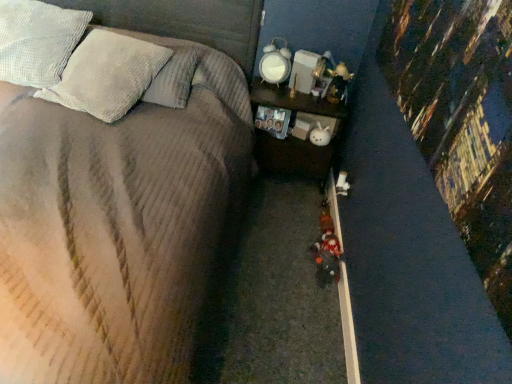
Question: From the image's perspective, is corduroy fabric bed at center under wooden nightstand at center?

Choices:
 (A) yes
 (B) no

Answer: (A)

Question: Is corduroy fabric bed at center further to camera compared to wooden nightstand at center?

Choices:
 (A) no
 (B) yes

Answer: (A)

Question: From a real-world perspective, is corduroy fabric bed at center over wooden nightstand at center?

Choices:
 (A) no
 (B) yes

Answer: (B)

Question: Is corduroy fabric bed at center smaller than wooden nightstand at center?

Choices:
 (A) no
 (B) yes

Answer: (A)

Question: Is corduroy fabric bed at center to the left of wooden nightstand at center from the viewer's perspective?

Choices:
 (A) yes
 (B) no

Answer: (A)

Question: Looking at their shapes, would you say smooth concrete curb at lower right is wider or thinner than plush fabric toy at center?

Choices:
 (A) wide
 (B) thin

Answer: (B)

Question: Is point (330, 196) positioned closer to the camera than point (330, 258)?

Choices:
 (A) farther
 (B) closer

Answer: (A)

Question: Looking at the image, does smooth concrete curb at lower right seem bigger or smaller compared to plush fabric toy at center?

Choices:
 (A) small
 (B) big

Answer: (A)

Question: From the image's perspective, relative to plush fabric toy at center, is smooth concrete curb at lower right above or below?

Choices:
 (A) above
 (B) below

Answer: (B)

Question: Looking at their shapes, would you say wooden nightstand at center is wider or thinner than white textured pillow at upper left, which is the second pillow in left-to-right order?

Choices:
 (A) thin
 (B) wide

Answer: (A)

Question: Looking at the image, does wooden nightstand at center seem bigger or smaller compared to white textured pillow at upper left, acting as the 1th pillow starting from the right?

Choices:
 (A) big
 (B) small

Answer: (A)

Question: From a real-world perspective, relative to white textured pillow at upper left, acting as the 1th pillow starting from the right, is wooden nightstand at center vertically above or below?

Choices:
 (A) above
 (B) below

Answer: (B)

Question: Is point (258, 92) positioned closer to the camera than point (138, 81)?

Choices:
 (A) farther
 (B) closer

Answer: (A)

Question: From the image's perspective, is corduroy fabric bed at center located above or below wooden nightstand at center?

Choices:
 (A) below
 (B) above

Answer: (A)

Question: In the image, is corduroy fabric bed at center on the left side or the right side of wooden nightstand at center?

Choices:
 (A) right
 (B) left

Answer: (B)